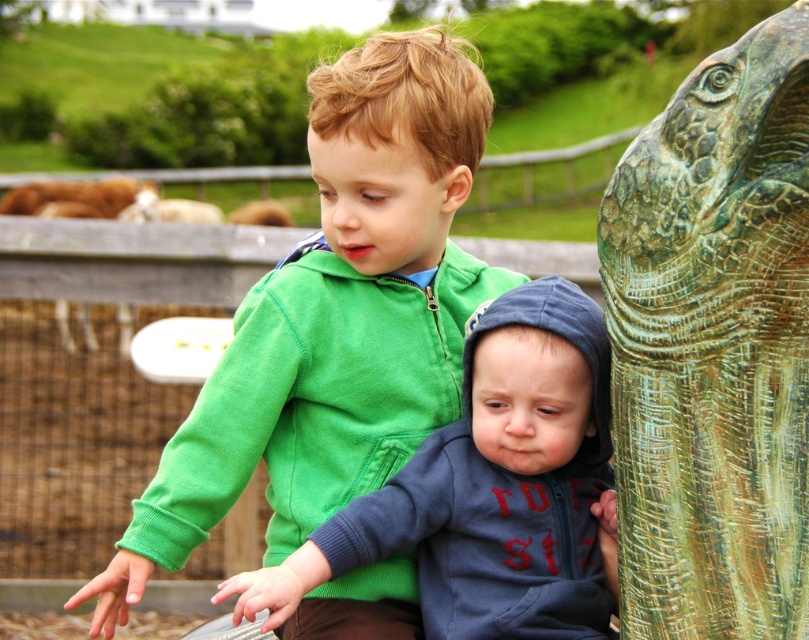
Question: Among these objects, which one is farthest from the camera?

Choices:
 (A) green matte hoodie at center
 (B) blue fleece hoodie at center
 (C) green patina stone elephant at right

Answer: (A)

Question: Which point appears closest to the camera in this image?

Choices:
 (A) (176, 520)
 (B) (539, 321)
 (C) (608, 336)

Answer: (C)

Question: Observing the image, what is the correct spatial positioning of green matte hoodie at center in reference to green patina stone elephant at right?

Choices:
 (A) below
 (B) above

Answer: (A)

Question: Is the position of green patina stone elephant at right more distant than that of blue fleece hoodie at center?

Choices:
 (A) no
 (B) yes

Answer: (A)

Question: Which object is farther from the camera taking this photo?

Choices:
 (A) blue fleece hoodie at center
 (B) green matte hoodie at center
 (C) green patina stone elephant at right

Answer: (B)

Question: Can you confirm if green patina stone elephant at right is positioned to the right of blue fleece hoodie at center?

Choices:
 (A) no
 (B) yes

Answer: (B)